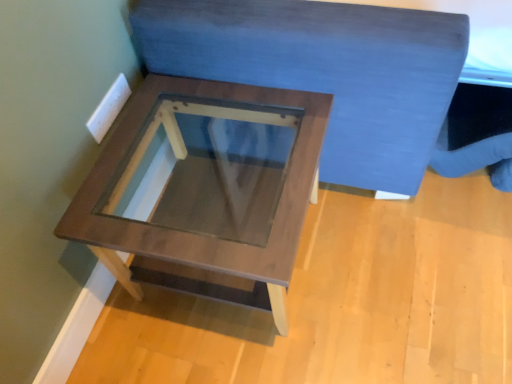
Locate an element on the screen. The image size is (512, 384). wooden table at center is located at coordinates (205, 190).

This screenshot has width=512, height=384. Describe the element at coordinates (205, 190) in the screenshot. I see `wooden table at center` at that location.

Locate an element on the screen. This screenshot has height=384, width=512. velvet blue bedding at upper center is located at coordinates (325, 71).

This screenshot has width=512, height=384. Describe the element at coordinates (325, 71) in the screenshot. I see `velvet blue bedding at upper center` at that location.

I want to click on wooden table at center, so click(x=205, y=190).

Considering the positions of objects velvet blue bedding at upper center and wooden table at center in the image provided, who is more to the right, velvet blue bedding at upper center or wooden table at center?

From the viewer's perspective, velvet blue bedding at upper center appears more on the right side.

Is velvet blue bedding at upper center further to camera compared to wooden table at center?

No.

Does point (338, 100) come in front of point (180, 242)?

No, it is not.

From the image's perspective, does velvet blue bedding at upper center appear lower than wooden table at center?

Incorrect, from the image's perspective, velvet blue bedding at upper center is higher than wooden table at center.

From a real-world perspective, is velvet blue bedding at upper center physically above wooden table at center?

Yes.

Can you confirm if velvet blue bedding at upper center is wider than wooden table at center?

Yes.

In terms of height, does velvet blue bedding at upper center look taller or shorter compared to wooden table at center?

Clearly, velvet blue bedding at upper center is taller compared to wooden table at center.

Considering the relative sizes of velvet blue bedding at upper center and wooden table at center in the image provided, is velvet blue bedding at upper center smaller than wooden table at center?

No, velvet blue bedding at upper center is not smaller than wooden table at center.

Is wooden table at center completely or partially inside velvet blue bedding at upper center?

Actually, wooden table at center is outside velvet blue bedding at upper center.

Is velvet blue bedding at upper center directly adjacent to wooden table at center?

No, velvet blue bedding at upper center is not making contact with wooden table at center.

Could you tell me if velvet blue bedding at upper center is facing wooden table at center?

No, velvet blue bedding at upper center is not oriented towards wooden table at center.

How many degrees apart are the facing directions of velvet blue bedding at upper center and wooden table at center?

The angular difference between velvet blue bedding at upper center and wooden table at center is 1.26 degrees.

Measure the distance from velvet blue bedding at upper center to wooden table at center.

The distance of velvet blue bedding at upper center from wooden table at center is 11.80 inches.

This screenshot has height=384, width=512. What are the coordinates of `bedding that is on the right side of wooden table at center` in the screenshot? It's located at (325, 71).

Consider the image. Considering the positions of objects wooden table at center and velvet blue bedding at upper center in the image provided, who is more to the left, wooden table at center or velvet blue bedding at upper center?

wooden table at center.

Which is in front, wooden table at center or velvet blue bedding at upper center?

Positioned in front is velvet blue bedding at upper center.

Is point (281, 133) positioned behind point (411, 150)?

That is True.

From the image's perspective, who appears lower, wooden table at center or velvet blue bedding at upper center?

wooden table at center.

From a real-world perspective, is wooden table at center located beneath velvet blue bedding at upper center?

Yes, from a real-world perspective, wooden table at center is beneath velvet blue bedding at upper center.

Considering the sizes of objects wooden table at center and velvet blue bedding at upper center in the image provided, who is thinner, wooden table at center or velvet blue bedding at upper center?

wooden table at center.

Considering the relative sizes of wooden table at center and velvet blue bedding at upper center in the image provided, is wooden table at center taller than velvet blue bedding at upper center?

In fact, wooden table at center may be shorter than velvet blue bedding at upper center.

Looking at this image, can you confirm if wooden table at center is smaller than velvet blue bedding at upper center?

Correct, wooden table at center occupies less space than velvet blue bedding at upper center.

Would you say wooden table at center is outside velvet blue bedding at upper center?

Yes, wooden table at center is located beyond the bounds of velvet blue bedding at upper center.

Does wooden table at center touch velvet blue bedding at upper center?

No, wooden table at center is not making contact with velvet blue bedding at upper center.

Based on the photo, is wooden table at center oriented away from velvet blue bedding at upper center?

No.

Identify the location of bedding lying in front of the wooden table at center. The image size is (512, 384). (325, 71).

The width and height of the screenshot is (512, 384). In order to click on table below the velvet blue bedding at upper center (from a real-world perspective) in this screenshot , I will do `click(205, 190)`.

Where is `bedding located above the wooden table at center (from a real-world perspective)`? This screenshot has width=512, height=384. bedding located above the wooden table at center (from a real-world perspective) is located at coordinates (325, 71).